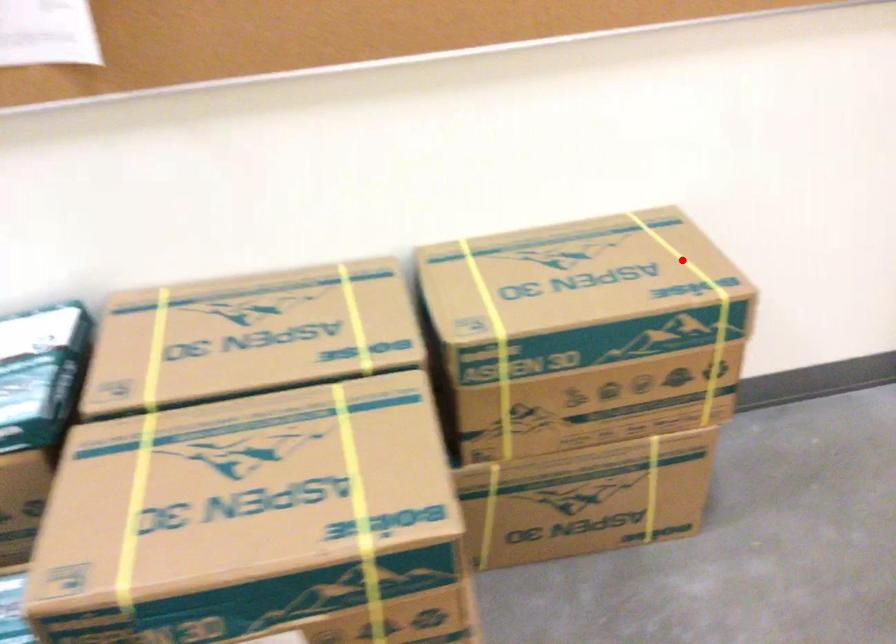
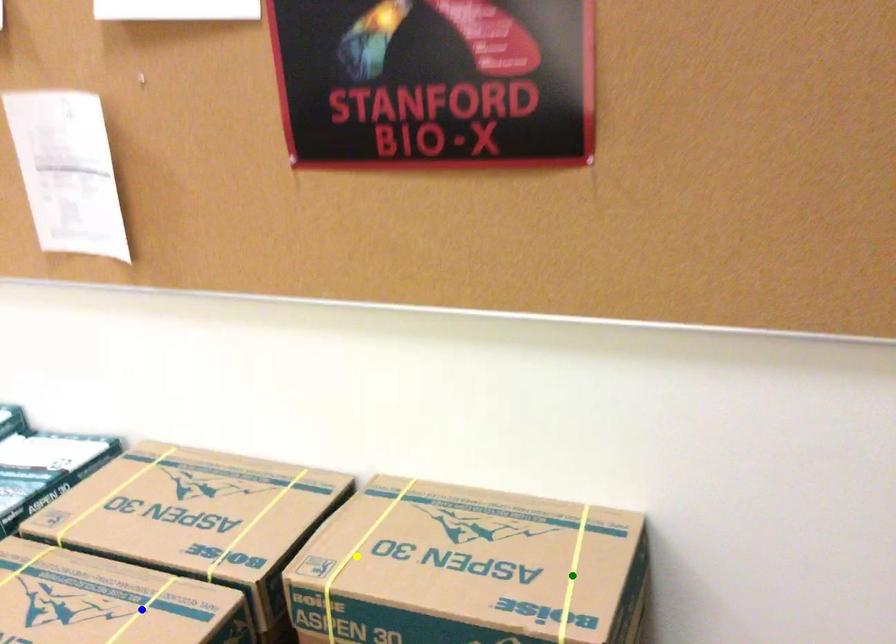
Question: I am providing you with two images of the same scene from different viewpoints. A red point is marked on the first image. You are given multiple points on the second image. Which point in image 2 is actually the same real-world point as the red point in image 1?

Choices:
 (A) yellow point
 (B) green point
 (C) blue point

Answer: (B)